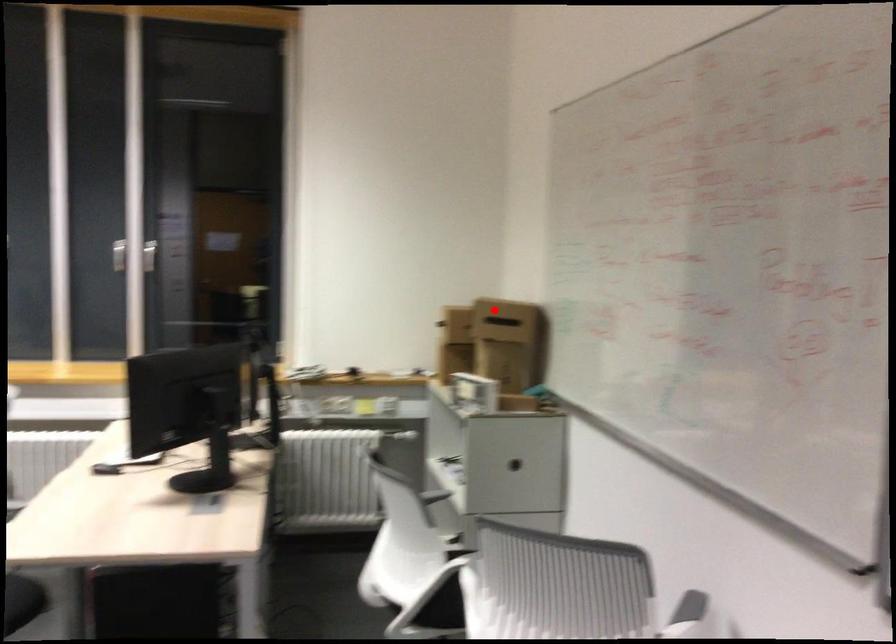
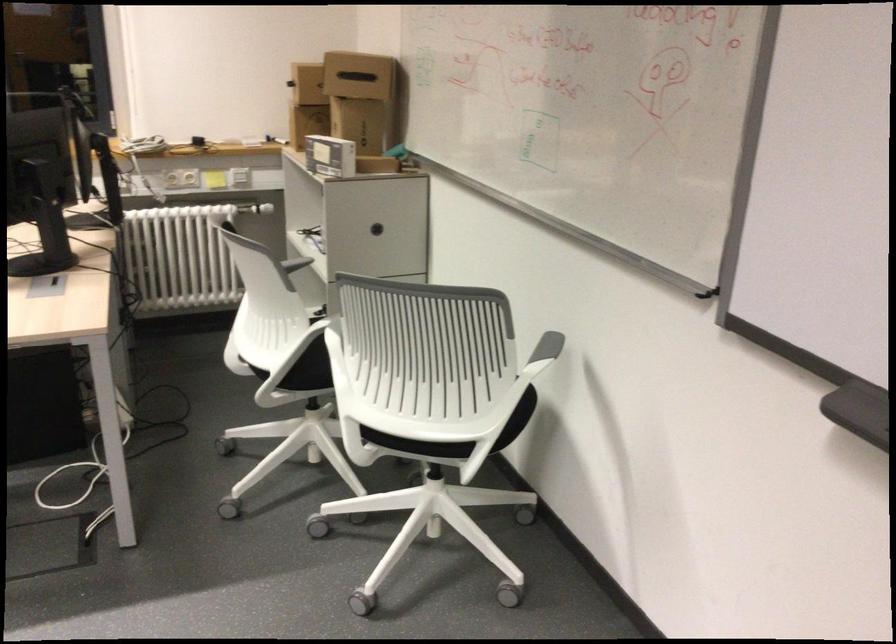
Where in the second image is the point corresponding to the highlighted location from the first image?

(357, 76)